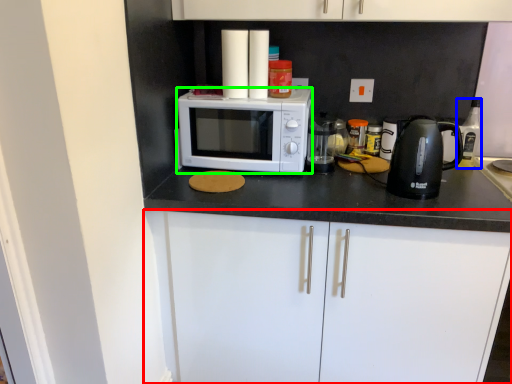
Question: Which object is the closest to the cabinetry (highlighted by a red box)? Choose among these: bottle (highlighted by a blue box) or microwave oven (highlighted by a green box).

Choices:
 (A) bottle
 (B) microwave oven

Answer: (B)